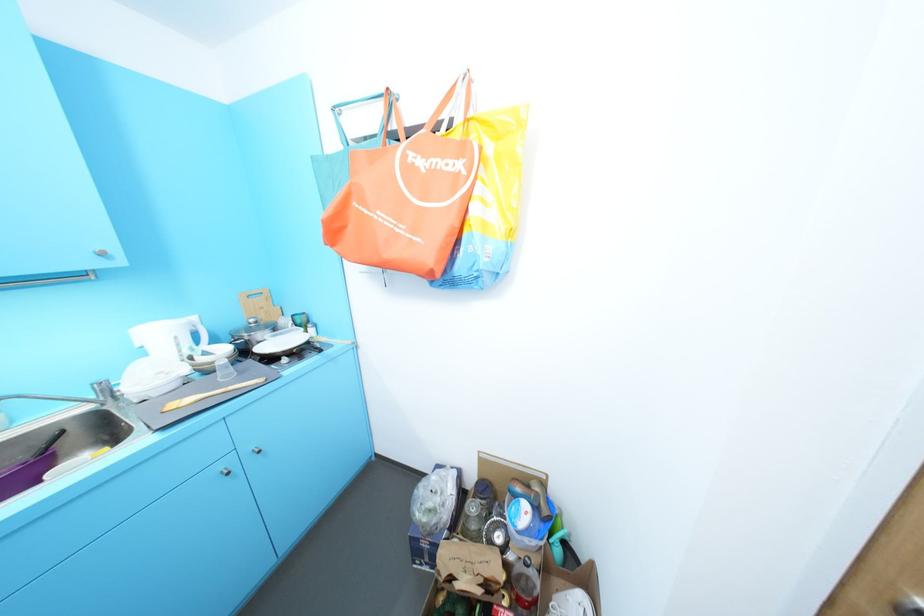
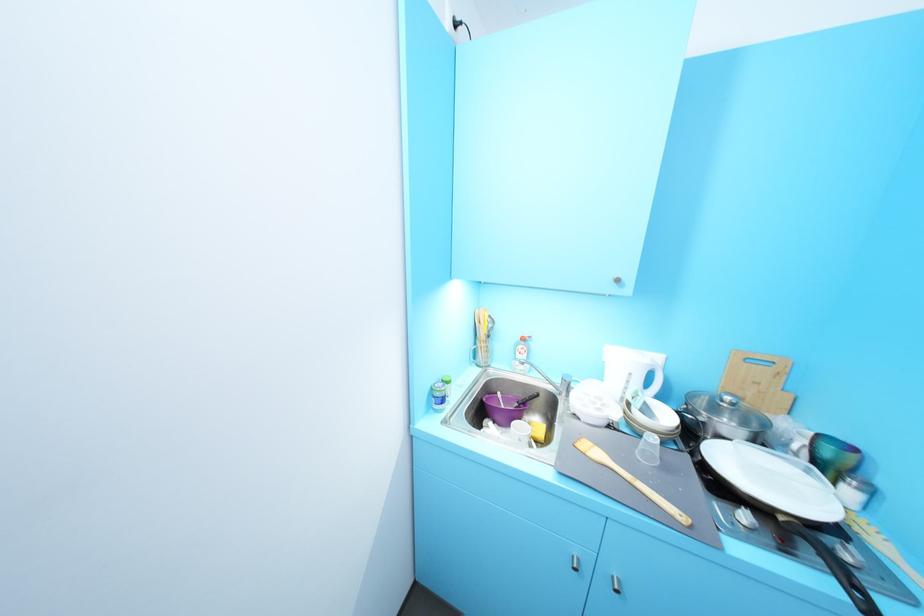
In the second image, find the point that corresponds to (248,373) in the first image.

(673, 468)